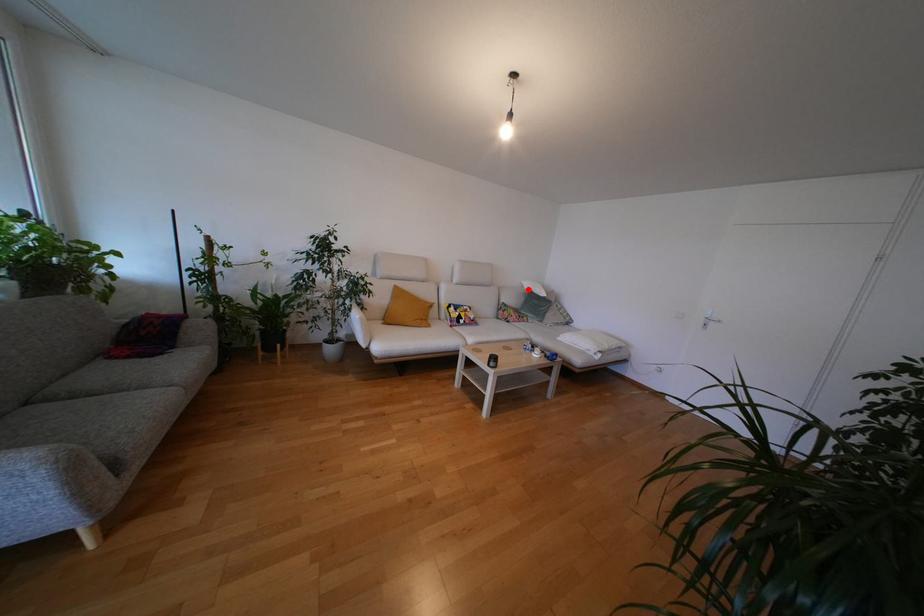
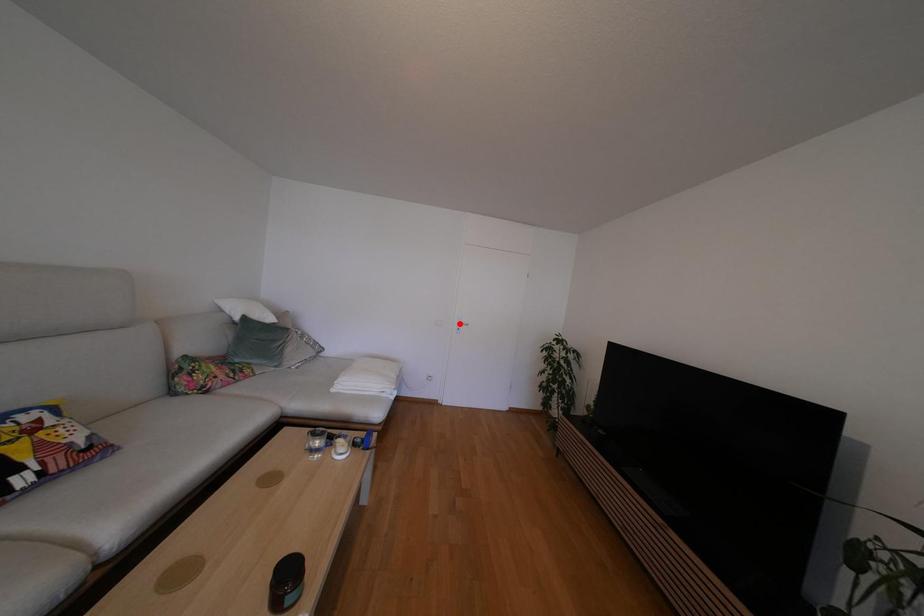
I am providing you with two images of the same scene from different viewpoints. A red point is marked on the first image and another point is marked on the second image. Do the highlighted points in image1 and image2 indicate the same real-world spot?

No